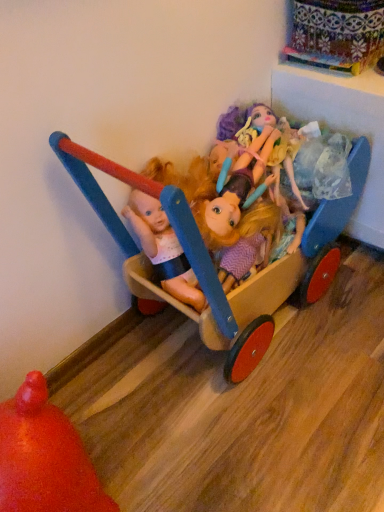
The width and height of the screenshot is (384, 512). I want to click on wooden cart at center, marked as the first toy in a right-to-left arrangement, so click(x=251, y=324).

At what (x,y) coordinates should I click in order to perform the action: click on wooden cart at center, which appears as the second toy when viewed from the left. Please return your answer as a coordinate pair (x, y). The height and width of the screenshot is (512, 384). Looking at the image, I should click on (251, 324).

Does matte plastic dolls at center lie in front of rubberized orange ball at lower left, which is the second toy from right to left?

No, it is not.

Is matte plastic dolls at center beside rubberized orange ball at lower left, which is the second toy from right to left?

No, matte plastic dolls at center is not beside rubberized orange ball at lower left, which is the second toy from right to left.

From a real-world perspective, who is located lower, matte plastic dolls at center or rubberized orange ball at lower left, which is the first toy from left to right?

In real-world perspective, rubberized orange ball at lower left, which is the first toy from left to right, is lower.

Between matte plastic dolls at center and rubberized orange ball at lower left, which is the second toy from right to left, which one has more height?

rubberized orange ball at lower left, which is the second toy from right to left.

Which is more distant, (x=147, y=260) or (x=295, y=247)?

The point (x=295, y=247) is more distant.

Is wooden cart at center, marked as the first toy in a right-to-left arrangement, positioned beyond the bounds of matte plastic dolls at center?

That's correct, wooden cart at center, marked as the first toy in a right-to-left arrangement, is outside of matte plastic dolls at center.

Can you confirm if wooden cart at center, marked as the first toy in a right-to-left arrangement, is thinner than matte plastic dolls at center?

No.

This screenshot has height=512, width=384. I want to click on doll located on the left of wooden cart at center, marked as the first toy in a right-to-left arrangement, so click(x=237, y=195).

I want to click on toy to the right of rubberized orange ball at lower left, which is the first toy from left to right, so click(x=251, y=324).

From a real-world perspective, is wooden cart at center, marked as the first toy in a right-to-left arrangement, on top of rubberized orange ball at lower left, which is the second toy from right to left?

Yes, from a real-world perspective, wooden cart at center, marked as the first toy in a right-to-left arrangement, is over rubberized orange ball at lower left, which is the second toy from right to left

Considering the relative sizes of wooden cart at center, marked as the first toy in a right-to-left arrangement, and rubberized orange ball at lower left, which is the second toy from right to left, in the image provided, is wooden cart at center, marked as the first toy in a right-to-left arrangement, thinner than rubberized orange ball at lower left, which is the second toy from right to left,?

No.

Who is bigger, wooden cart at center, marked as the first toy in a right-to-left arrangement, or rubberized orange ball at lower left, which is the second toy from right to left?

wooden cart at center, marked as the first toy in a right-to-left arrangement.

Is rubberized orange ball at lower left, which is the second toy from right to left, oriented towards matte plastic dolls at center?

No, rubberized orange ball at lower left, which is the second toy from right to left, does not turn towards matte plastic dolls at center.

From the picture: Is rubberized orange ball at lower left, which is the first toy from left to right, bigger or smaller than matte plastic dolls at center?

rubberized orange ball at lower left, which is the first toy from left to right, is bigger than matte plastic dolls at center.

Is the surface of rubberized orange ball at lower left, which is the first toy from left to right, in direct contact with matte plastic dolls at center?

No, rubberized orange ball at lower left, which is the first toy from left to right, is not touching matte plastic dolls at center.

From a real-world perspective, is rubberized orange ball at lower left, which is the first toy from left to right, on top of matte plastic dolls at center?

Incorrect, from a real-world perspective, rubberized orange ball at lower left, which is the first toy from left to right, is lower than matte plastic dolls at center.

Considering the relative positions of rubberized orange ball at lower left, which is the second toy from right to left, and wooden cart at center, marked as the first toy in a right-to-left arrangement, in the image provided, is rubberized orange ball at lower left, which is the second toy from right to left, in front of wooden cart at center, marked as the first toy in a right-to-left arrangement,?

Yes, rubberized orange ball at lower left, which is the second toy from right to left, is closer to the viewer.

Does rubberized orange ball at lower left, which is the first toy from left to right, turn towards wooden cart at center, marked as the first toy in a right-to-left arrangement?

No, rubberized orange ball at lower left, which is the first toy from left to right, does not turn towards wooden cart at center, marked as the first toy in a right-to-left arrangement.

Considering the relative sizes of rubberized orange ball at lower left, which is the second toy from right to left, and wooden cart at center, marked as the first toy in a right-to-left arrangement, in the image provided, is rubberized orange ball at lower left, which is the second toy from right to left, shorter than wooden cart at center, marked as the first toy in a right-to-left arrangement,?

Yes, rubberized orange ball at lower left, which is the second toy from right to left, is shorter than wooden cart at center, marked as the first toy in a right-to-left arrangement.

Is rubberized orange ball at lower left, which is the first toy from left to right, spatially inside wooden cart at center, which appears as the second toy when viewed from the left, or outside of it?

rubberized orange ball at lower left, which is the first toy from left to right, lies outside wooden cart at center, which appears as the second toy when viewed from the left.

Looking at this image, from the image's perspective, is matte plastic dolls at center located above or below wooden cart at center, marked as the first toy in a right-to-left arrangement?

Based on their image positions, matte plastic dolls at center is located above wooden cart at center, marked as the first toy in a right-to-left arrangement.

Could you tell me if matte plastic dolls at center is turned towards wooden cart at center, which appears as the second toy when viewed from the left?

Yes, matte plastic dolls at center is turned towards wooden cart at center, which appears as the second toy when viewed from the left.

Is the position of matte plastic dolls at center less distant than that of wooden cart at center, which appears as the second toy when viewed from the left?

No, matte plastic dolls at center is behind wooden cart at center, which appears as the second toy when viewed from the left.

Which of these two, matte plastic dolls at center or wooden cart at center, marked as the first toy in a right-to-left arrangement, is thinner?

matte plastic dolls at center.

Find the location of a particular element. The image size is (384, 512). doll behind the rubberized orange ball at lower left, which is the second toy from right to left is located at coordinates (237, 195).

In order to click on toy on the right of matte plastic dolls at center in this screenshot , I will do `click(251, 324)`.

Based on their spatial positions, is matte plastic dolls at center or wooden cart at center, marked as the first toy in a right-to-left arrangement, closer to rubberized orange ball at lower left, which is the second toy from right to left?

wooden cart at center, marked as the first toy in a right-to-left arrangement, is closer to rubberized orange ball at lower left, which is the second toy from right to left.

Considering their positions, is rubberized orange ball at lower left, which is the second toy from right to left, positioned further to matte plastic dolls at center than wooden cart at center, marked as the first toy in a right-to-left arrangement?

Among the two, rubberized orange ball at lower left, which is the second toy from right to left, is located further to matte plastic dolls at center.

Which object lies nearer to the anchor point matte plastic dolls at center, wooden cart at center, which appears as the second toy when viewed from the left, or rubberized orange ball at lower left, which is the second toy from right to left?

Among the two, wooden cart at center, which appears as the second toy when viewed from the left, is located nearer to matte plastic dolls at center.

In the scene shown: Estimate the real-world distances between objects in this image. Which object is closer to wooden cart at center, which appears as the second toy when viewed from the left, rubberized orange ball at lower left, which is the second toy from right to left, or matte plastic dolls at center?

The object closer to wooden cart at center, which appears as the second toy when viewed from the left, is matte plastic dolls at center.

Considering their positions, is wooden cart at center, which appears as the second toy when viewed from the left, positioned closer to rubberized orange ball at lower left, which is the second toy from right to left, than matte plastic dolls at center?

Among the two, wooden cart at center, which appears as the second toy when viewed from the left, is located nearer to rubberized orange ball at lower left, which is the second toy from right to left.

Based on their spatial positions, is matte plastic dolls at center or rubberized orange ball at lower left, which is the first toy from left to right, closer to wooden cart at center, marked as the first toy in a right-to-left arrangement?

matte plastic dolls at center lies closer to wooden cart at center, marked as the first toy in a right-to-left arrangement, than the other object.

Image resolution: width=384 pixels, height=512 pixels. What are the coordinates of `toy that lies between matte plastic dolls at center and rubberized orange ball at lower left, which is the first toy from left to right, from top to bottom` in the screenshot? It's located at (251, 324).